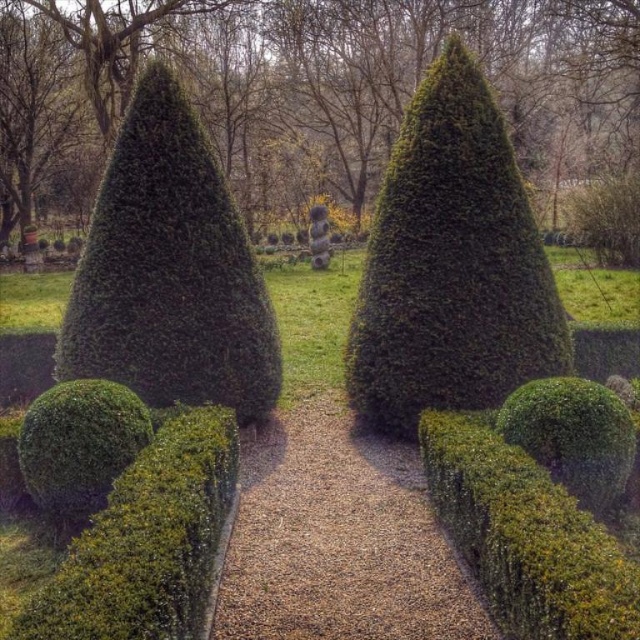
You are a gardener who needs to place a 4.5 foot long decorative bench between the green leafy shrub at left and the green matte sphere at lower left. Can the bench fit in the space between them without overlapping either?

The distance between the green leafy shrub at left and the green matte sphere at lower left is 5.00 feet. Since the bench is 4.5 feet long, it can fit within the space as 4.5 is less than 5.00.

You are a gardener standing at the entrance of the garden pathway. You need to trim the green textured hedge at center. Based on its location coordinates, which direction should you move to reach it?

The green textured hedge at center is located at point coordinates, so you should move towards the center of the pathway to reach it.